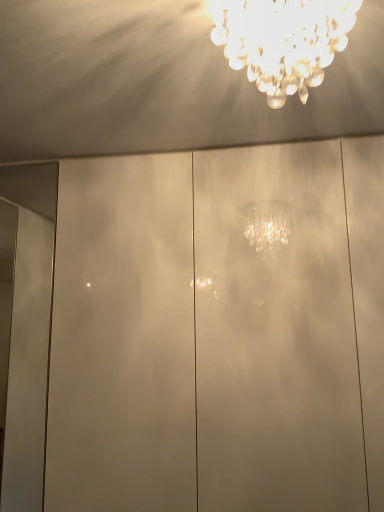
Question: Is white glossy door at left turned away from glossy white glass door at center?

Choices:
 (A) yes
 (B) no

Answer: (B)

Question: Is white glossy door at left wider than glossy white glass door at center?

Choices:
 (A) yes
 (B) no

Answer: (B)

Question: From the image's perspective, is white glossy door at left over glossy white glass door at center?

Choices:
 (A) no
 (B) yes

Answer: (B)

Question: From a real-world perspective, is white glossy door at left located higher than glossy white glass door at center?

Choices:
 (A) yes
 (B) no

Answer: (A)

Question: Does white glossy door at left have a lesser height compared to glossy white glass door at center?

Choices:
 (A) yes
 (B) no

Answer: (A)

Question: From the image's perspective, is white glossy door at left above or below glossy white glass door at center?

Choices:
 (A) below
 (B) above

Answer: (B)

Question: Would you say white glossy door at left is inside or outside glossy white glass door at center?

Choices:
 (A) outside
 (B) inside

Answer: (A)

Question: Considering the positions of white glossy door at left and glossy white glass door at center in the image, is white glossy door at left wider or thinner than glossy white glass door at center?

Choices:
 (A) thin
 (B) wide

Answer: (A)

Question: Is white glossy door at left to the left or to the right of glossy white glass door at center in the image?

Choices:
 (A) right
 (B) left

Answer: (B)

Question: Looking at their shapes, would you say glossy white glass door at center is wider or thinner than clear crystal chandelier at upper center?

Choices:
 (A) thin
 (B) wide

Answer: (B)

Question: Do you think glossy white glass door at center is within clear crystal chandelier at upper center, or outside of it?

Choices:
 (A) outside
 (B) inside

Answer: (A)

Question: Considering the relative positions of glossy white glass door at center and clear crystal chandelier at upper center in the image provided, is glossy white glass door at center to the left or to the right of clear crystal chandelier at upper center?

Choices:
 (A) right
 (B) left

Answer: (A)

Question: Considering the positions of glossy white glass door at center and clear crystal chandelier at upper center in the image, is glossy white glass door at center taller or shorter than clear crystal chandelier at upper center?

Choices:
 (A) short
 (B) tall

Answer: (B)

Question: Is glossy white glass door at center spatially inside white glossy door at left, or outside of it?

Choices:
 (A) outside
 (B) inside

Answer: (A)

Question: From the image's perspective, relative to white glossy door at left, is glossy white glass door at center above or below?

Choices:
 (A) above
 (B) below

Answer: (B)